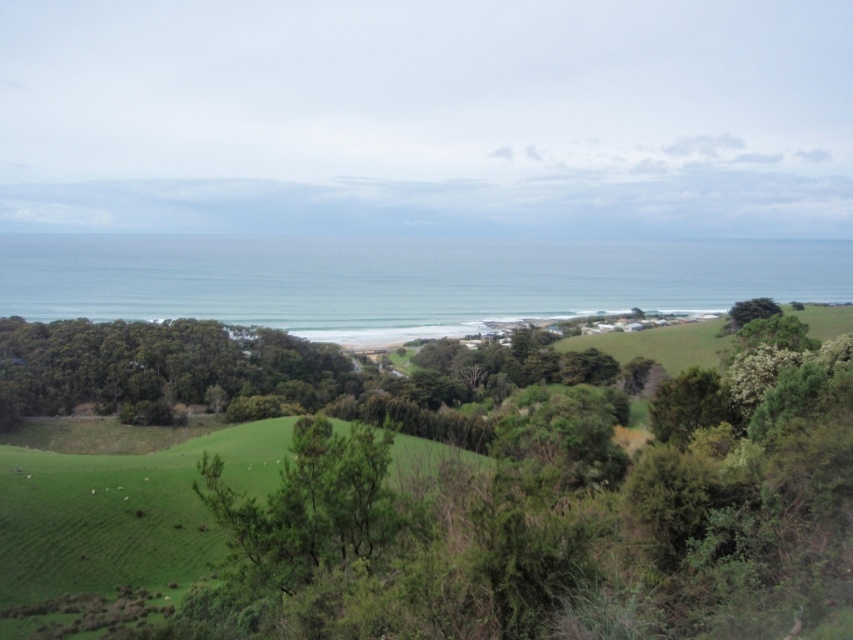
Consider the image. Can you confirm if green leafy tree at center is positioned below green leafy tree at right?

Indeed, green leafy tree at center is positioned under green leafy tree at right.

From the picture: Who is more forward, [271,580] or [759,307]?

Point [271,580] is in front.

Does point (234, 550) come behind point (729, 314)?

No, (234, 550) is in front of (729, 314).

Identify the location of green leafy tree at center. This screenshot has width=853, height=640. (309, 506).